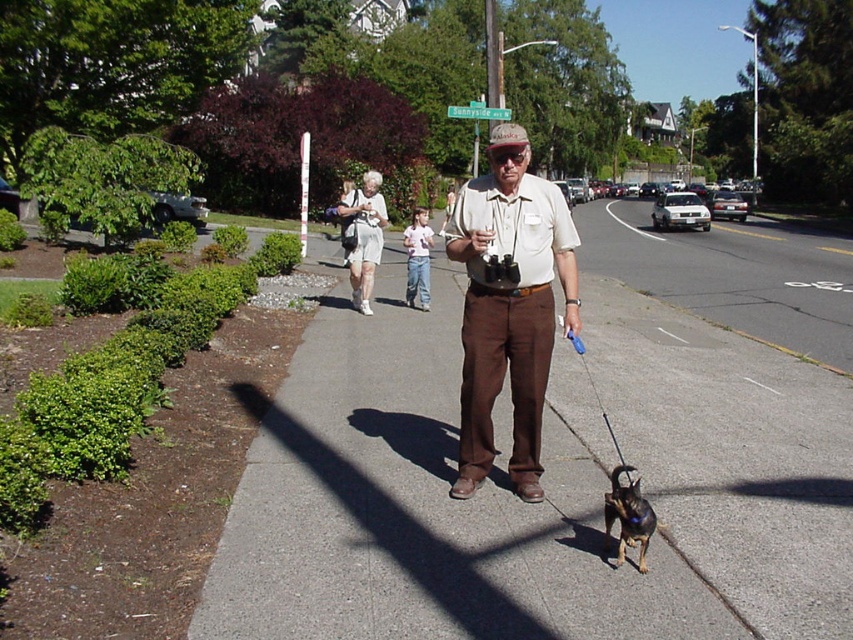
Question: Which object appears closest to the camera in this image?

Choices:
 (A) gray asphalt sidewalk at center
 (B) matte khaki shirt at center
 (C) shiny brown dog at lower center

Answer: (A)

Question: Is gray asphalt sidewalk at center bigger than matte khaki shirt at center?

Choices:
 (A) no
 (B) yes

Answer: (B)

Question: Which point appears farthest from the camera in this image?

Choices:
 (A) pos(459,348)
 (B) pos(610,490)

Answer: (A)

Question: Does gray asphalt sidewalk at center appear on the left side of shiny brown dog at lower center?

Choices:
 (A) yes
 (B) no

Answer: (B)

Question: Does gray asphalt sidewalk at center appear under matte khaki shirt at center?

Choices:
 (A) no
 (B) yes

Answer: (B)

Question: Which point is closer to the camera taking this photo?

Choices:
 (A) (636, 516)
 (B) (419, 417)

Answer: (A)